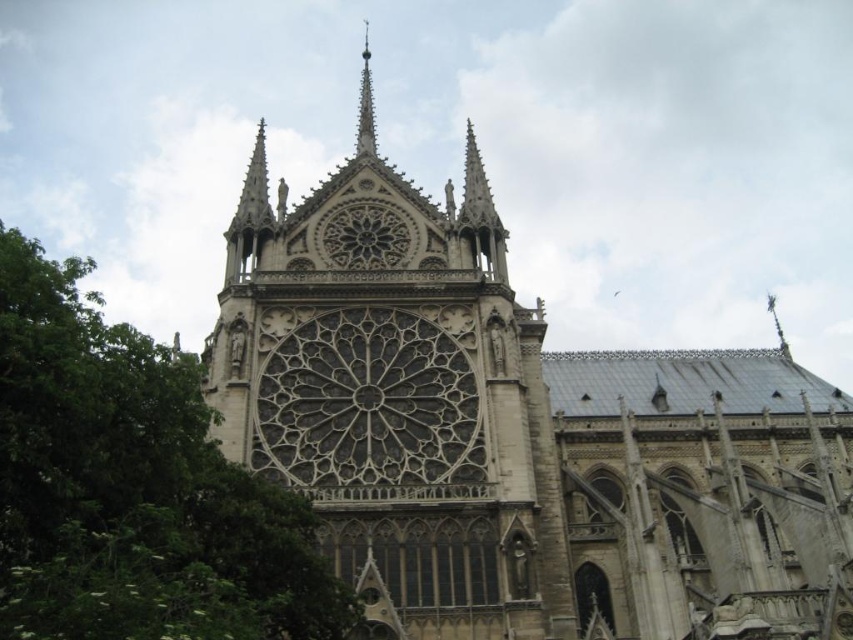
Question: Is green leafy tree at left bigger than polished silver spire at upper center?

Choices:
 (A) yes
 (B) no

Answer: (A)

Question: Is green leafy tree at left wider than polished silver spire at upper center?

Choices:
 (A) yes
 (B) no

Answer: (A)

Question: Which point is closer to the camera?

Choices:
 (A) (33, 292)
 (B) (370, 122)

Answer: (A)

Question: Which object appears closest to the camera in this image?

Choices:
 (A) polished silver spire at upper center
 (B) green leafy tree at left

Answer: (B)

Question: Can you confirm if green leafy tree at left is bigger than polished silver spire at upper center?

Choices:
 (A) no
 (B) yes

Answer: (B)